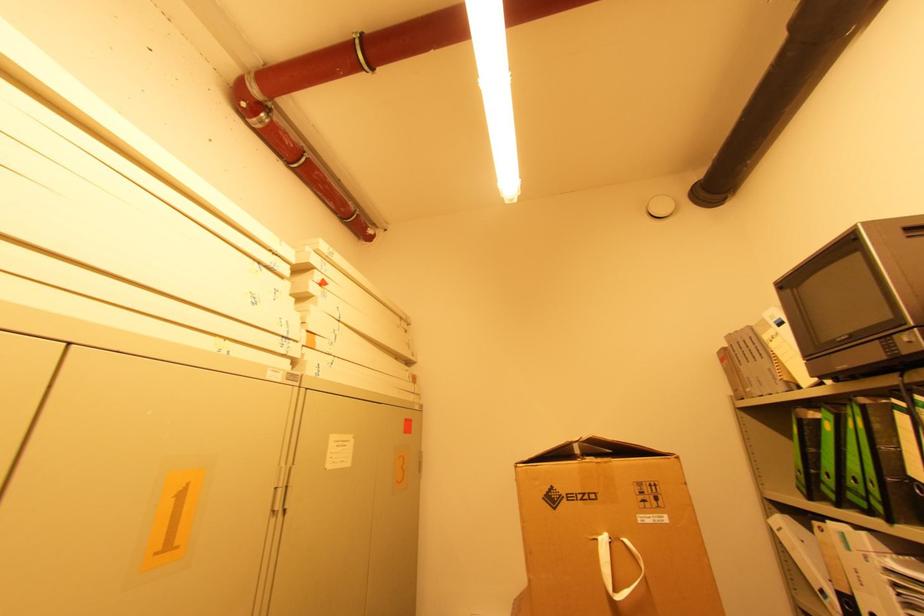
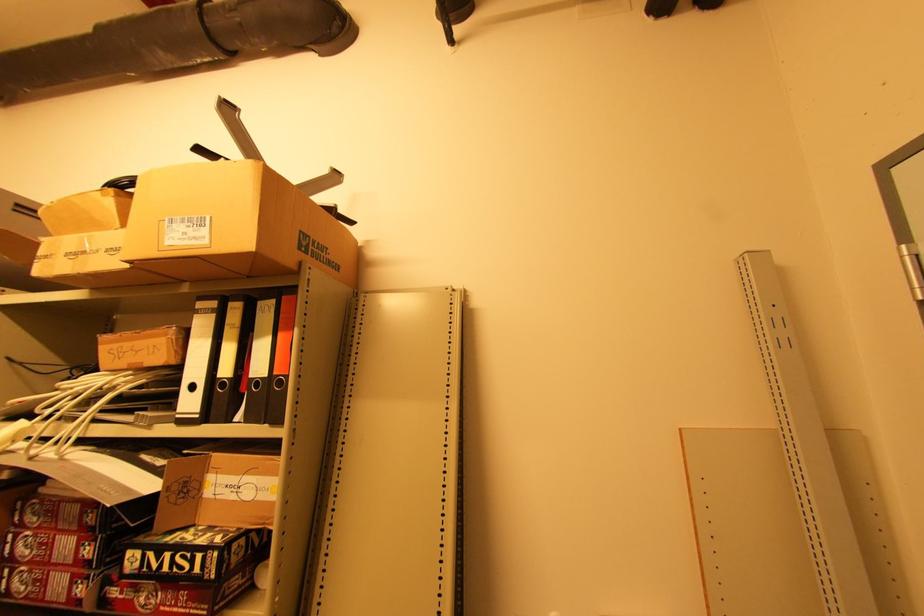
Question: The camera is either moving clockwise (left) or counter-clockwise (right) around the object. The first image is from the beginning of the video and the second image is from the end. Is the camera moving left or right when shooting the video?

Choices:
 (A) Left
 (B) Right

Answer: (A)